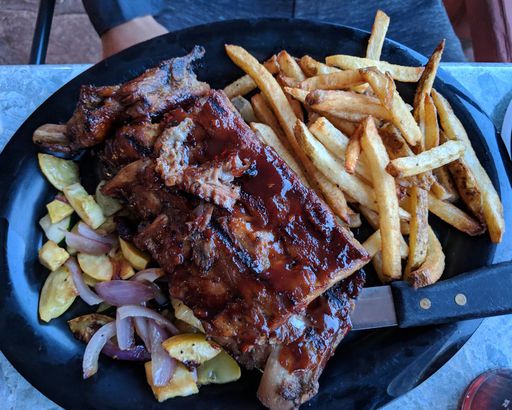
This screenshot has height=410, width=512. I want to click on handle, so click(479, 286).